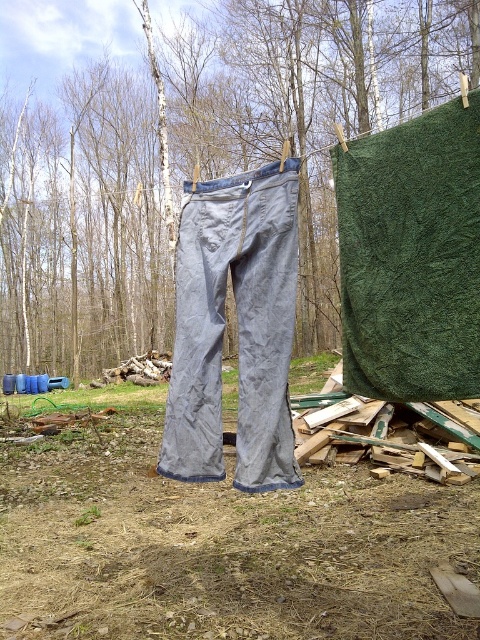
How distant is green fabric at center from green textured fabric at upper right?

green fabric at center is 73.15 feet away from green textured fabric at upper right.

Is green fabric at center smaller than green textured fabric at upper right?

Incorrect, green fabric at center is not smaller in size than green textured fabric at upper right.

This screenshot has width=480, height=640. Find the location of `green fabric at center`. green fabric at center is located at coordinates (201, 161).

Does green textured fabric at upper right have a larger size compared to gray cotton pants at center?

No.

Between green textured fabric at upper right and gray cotton pants at center, which one appears on the left side from the viewer's perspective?

gray cotton pants at center is more to the left.

You are a GUI agent. You are given a task and a screenshot of the screen. Output one action in this format:
    pyautogui.click(x=<x>, y=<y>)
    Task: Click on the green textured fabric at upper right
    Image resolution: width=480 pixels, height=640 pixels.
    Given the screenshot: What is the action you would take?
    pyautogui.click(x=411, y=257)

Find the location of a particular element. The width and height of the screenshot is (480, 640). green textured fabric at upper right is located at coordinates tap(411, 257).

Is green fabric at center below gray cotton pants at center?

No.

This screenshot has width=480, height=640. Find the location of `green fabric at center`. green fabric at center is located at coordinates (201, 161).